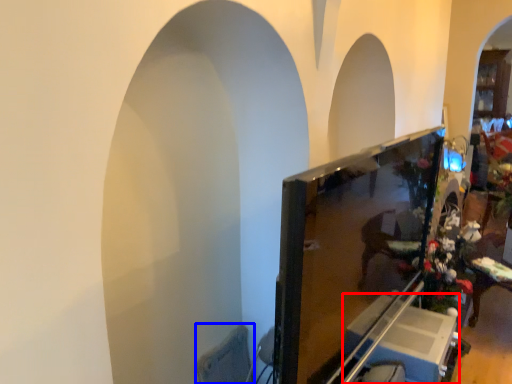
Question: Which point is further to the camera, furniture (highlighted by a red box) or swivel chair (highlighted by a blue box)?

Choices:
 (A) furniture
 (B) swivel chair

Answer: (A)